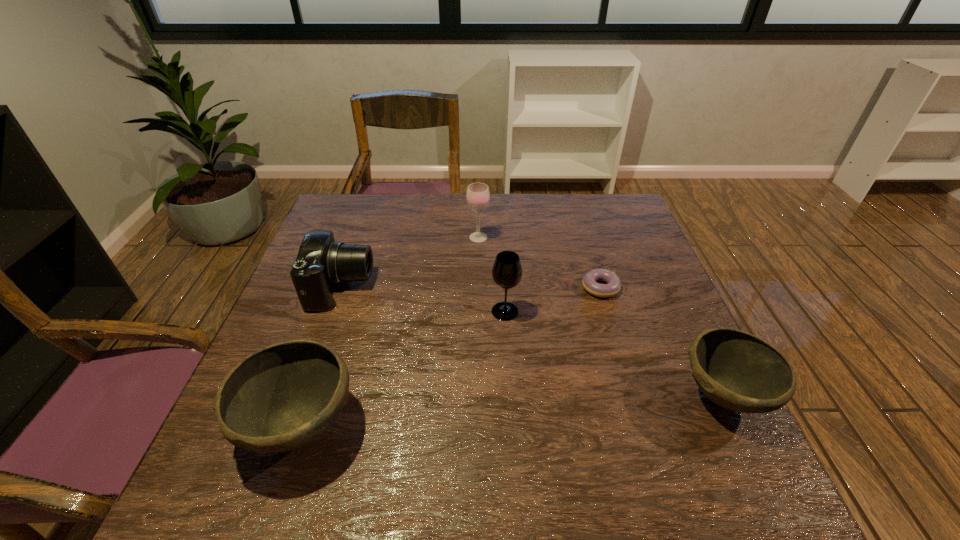
The image size is (960, 540). I want to click on object that is at the near right corner, so point(736,370).

Where is `vacant area at the far edge of the desktop`? vacant area at the far edge of the desktop is located at coordinates (476, 219).

Where is `vacant area at the near edge of the desktop`? This screenshot has width=960, height=540. vacant area at the near edge of the desktop is located at coordinates (636, 420).

Image resolution: width=960 pixels, height=540 pixels. I want to click on vacant space at the right edge of the desktop, so click(656, 286).

This screenshot has width=960, height=540. In the image, there is a desktop. Find the location of `vacant space at the far right corner`. vacant space at the far right corner is located at coordinates (602, 213).

You are a GUI agent. You are given a task and a screenshot of the screen. Output one action in this format:
    pyautogui.click(x=<x>, y=<y>)
    Task: Click on the vacant space that is in between the farther wineglass and the rightmost object
    The width and height of the screenshot is (960, 540).
    Given the screenshot: What is the action you would take?
    pyautogui.click(x=601, y=316)

Where is `empty space between the doughnut and the taller bowl`? This screenshot has height=540, width=960. empty space between the doughnut and the taller bowl is located at coordinates (450, 356).

The image size is (960, 540). I want to click on free point between the camera and the second object from right to left, so click(470, 287).

The image size is (960, 540). What are the coordinates of `vacant space that is in between the second object from right to left and the farther wineglass` in the screenshot? It's located at click(540, 262).

This screenshot has width=960, height=540. What are the coordinates of `empty location between the second object from right to left and the farthest object` in the screenshot? It's located at (540, 262).